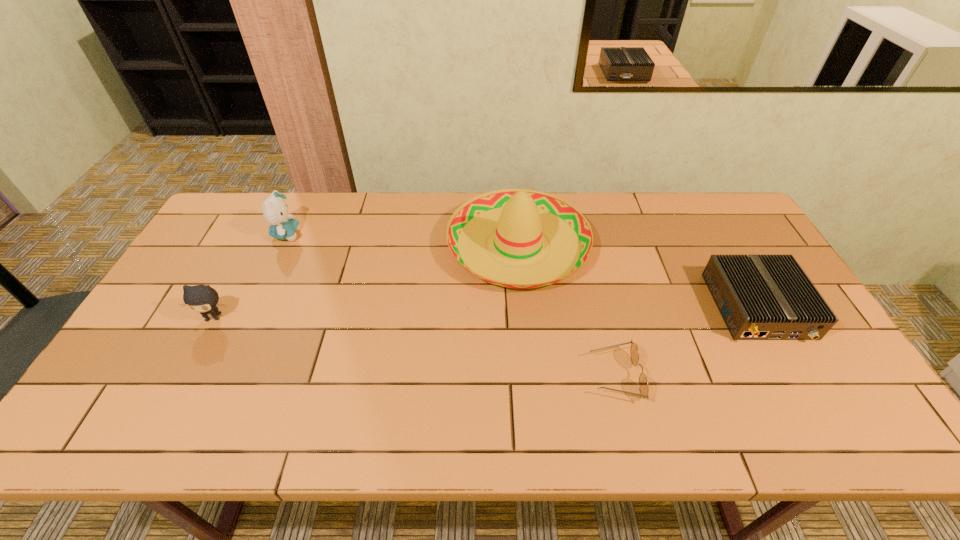
You are a GUI agent. You are given a task and a screenshot of the screen. Output one action in this format:
    pyautogui.click(x=<x>, y=<y>)
    Task: Click on the unoccupied area between the tallest object and the taller kitten
    
    Given the screenshot: What is the action you would take?
    pyautogui.click(x=402, y=240)

Where is `free space between the sombrero and the nearest object`? The width and height of the screenshot is (960, 540). free space between the sombrero and the nearest object is located at coordinates (566, 310).

Where is `vacant space that is in between the tallest object and the shortest object`? This screenshot has width=960, height=540. vacant space that is in between the tallest object and the shortest object is located at coordinates (566, 310).

Point out which object is positioned as the fourth nearest to the farther kitten. Please provide its 2D coordinates. Your answer should be formatted as a tuple, i.e. [(x, y)], where the tuple contains the x and y coordinates of a point satisfying the conditions above.

[(761, 297)]

Locate an element on the screen. The image size is (960, 540). the closest object relative to the tallest object is located at coordinates (634, 353).

Where is `free location that satisfies the following two spatial constraints: 1. on the back panel of the router; 2. on the front-facing side of the nearest object`? free location that satisfies the following two spatial constraints: 1. on the back panel of the router; 2. on the front-facing side of the nearest object is located at coordinates click(797, 376).

Where is `vacant space that satisfies the following two spatial constraints: 1. on the face of the fourth shortest object; 2. on the front-facing side of the nearer kitten`? Image resolution: width=960 pixels, height=540 pixels. vacant space that satisfies the following two spatial constraints: 1. on the face of the fourth shortest object; 2. on the front-facing side of the nearer kitten is located at coordinates (248, 317).

The height and width of the screenshot is (540, 960). In order to click on blank space that satisfies the following two spatial constraints: 1. on the face of the taller kitten; 2. on the front-facing side of the third shortest object in this screenshot , I will do `click(248, 317)`.